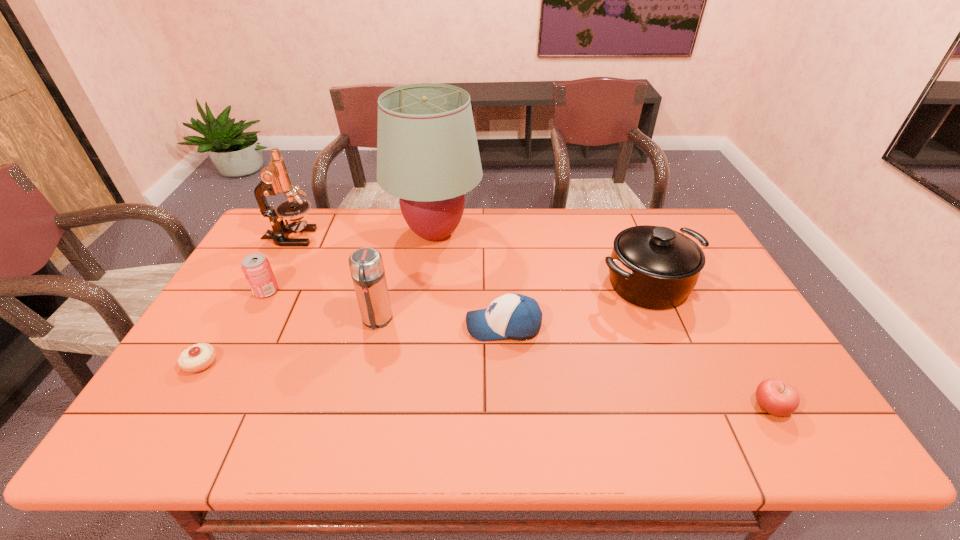
This screenshot has height=540, width=960. What are the coordinates of `lampshade` in the screenshot? It's located at (427, 153).

Locate an element on the screen. This screenshot has width=960, height=540. microscope is located at coordinates (274, 179).

Locate an element on the screen. thermos bottle is located at coordinates (366, 266).

Locate an element on the screen. the fifth shortest object is located at coordinates pyautogui.click(x=653, y=267).

Locate an element on the screen. The height and width of the screenshot is (540, 960). the fourth shortest object is located at coordinates (256, 267).

At what (x,y) coordinates should I click in order to perform the action: click on baseball cap. Please return your answer as a coordinate pair (x, y). This screenshot has width=960, height=540. Looking at the image, I should click on (514, 316).

Identify the location of apple. (777, 397).

Where is `the second shortest object`? The width and height of the screenshot is (960, 540). the second shortest object is located at coordinates (777, 397).

Where is `the seventh farthest object`? Image resolution: width=960 pixels, height=540 pixels. the seventh farthest object is located at coordinates (198, 357).

Where is `the shortest object`? the shortest object is located at coordinates (198, 357).